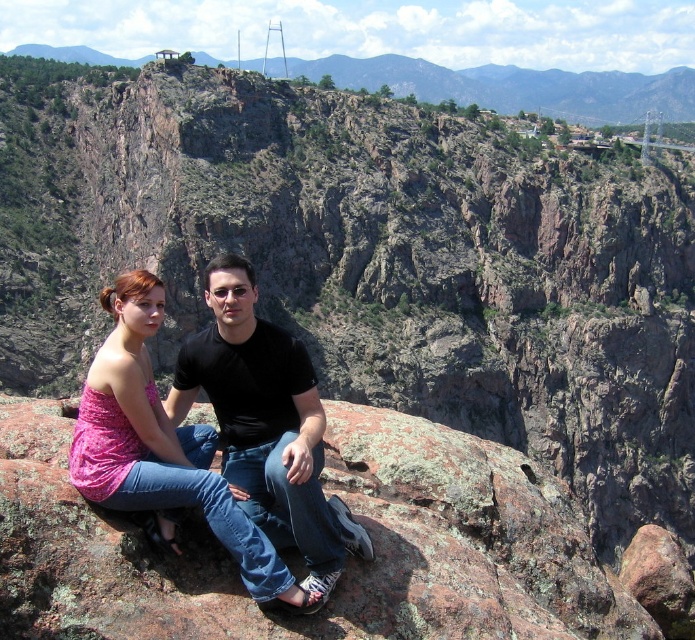
Question: From the image, what is the correct spatial relationship of black matte shirt at center in relation to rustic rock formation at upper center?

Choices:
 (A) below
 (B) above

Answer: (A)

Question: Among these objects, which one is nearest to the camera?

Choices:
 (A) black matte shirt at center
 (B) rustic rock formation at upper center

Answer: (A)

Question: Which point appears farthest from the camera in this image?

Choices:
 (A) (368, 540)
 (B) (591, 72)

Answer: (B)

Question: Which object is farther from the camera taking this photo?

Choices:
 (A) rustic rock formation at upper center
 (B) black matte shirt at center

Answer: (A)

Question: Can you confirm if black matte shirt at center is thinner than rustic rock formation at upper center?

Choices:
 (A) no
 (B) yes

Answer: (B)

Question: Is black matte shirt at center bigger than rustic rock formation at upper center?

Choices:
 (A) yes
 (B) no

Answer: (B)